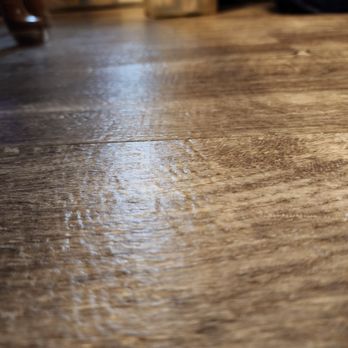
The image size is (348, 348). Identify the location of horizontal line in floor. (56, 145), (173, 139), (243, 136), (333, 132).